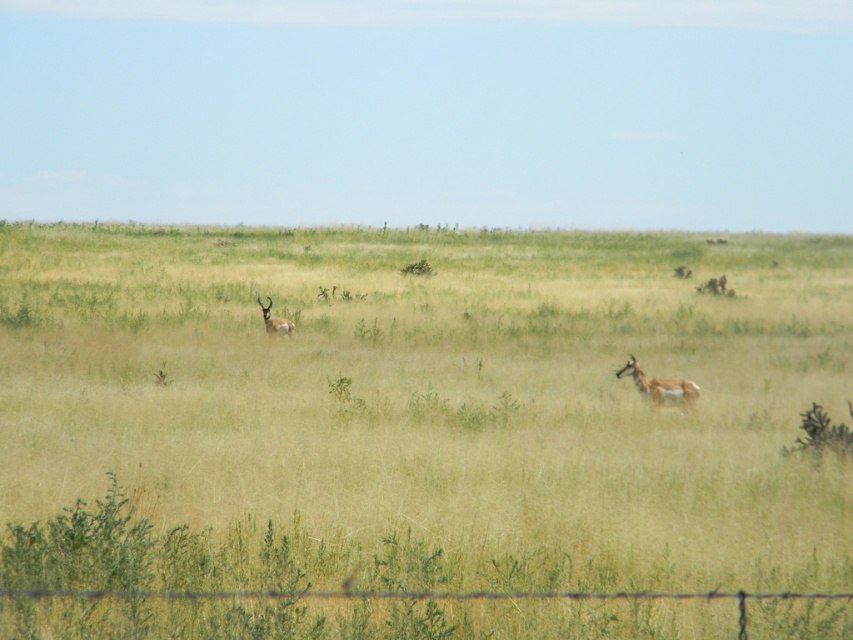
Question: Can you confirm if barbed wire at lower center is bigger than brown fur antelope at left?

Choices:
 (A) yes
 (B) no

Answer: (A)

Question: Can you confirm if barbed wire at lower center is positioned to the right of brown fur antelope at left?

Choices:
 (A) no
 (B) yes

Answer: (B)

Question: Is spotted fur antelope at center positioned behind brown fur antelope at left?

Choices:
 (A) yes
 (B) no

Answer: (B)

Question: Which of the following is the farthest from the observer?

Choices:
 (A) (276, 593)
 (B) (637, 372)

Answer: (B)

Question: Which of these objects is positioned closest to the barbed wire at lower center?

Choices:
 (A) spotted fur antelope at center
 (B) brown fur antelope at left

Answer: (A)

Question: Which point is closer to the camera?

Choices:
 (A) spotted fur antelope at center
 (B) barbed wire at lower center

Answer: (B)